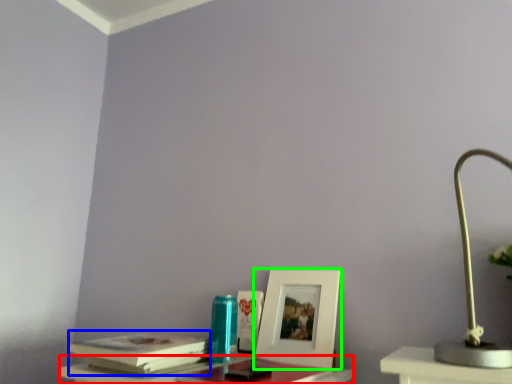
Question: Based on their relative distances, which object is nearer to table (highlighted by a red box)? Choose from paperback book (highlighted by a blue box) and picture frame (highlighted by a green box).

Choices:
 (A) paperback book
 (B) picture frame

Answer: (A)